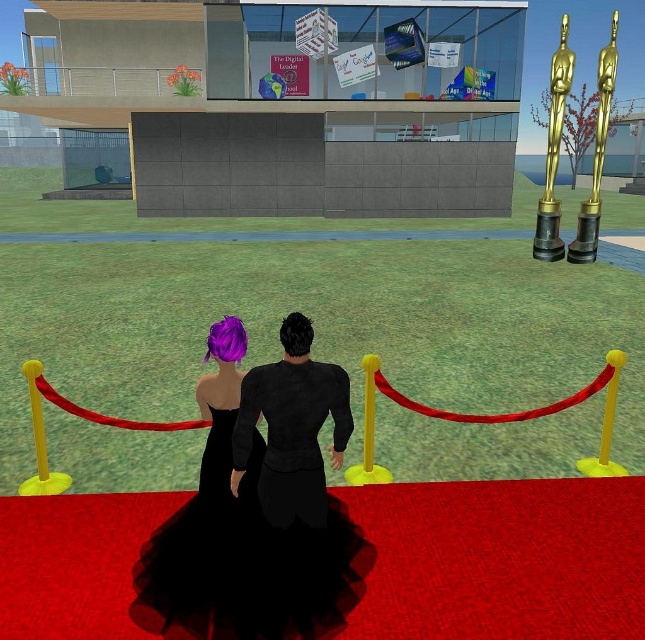
Is black velvet suit at center thinner than shiny purple hair at center?

Indeed, black velvet suit at center has a lesser width compared to shiny purple hair at center.

Can you confirm if black velvet suit at center is positioned below shiny purple hair at center?

Actually, black velvet suit at center is above shiny purple hair at center.

You are a GUI agent. You are given a task and a screenshot of the screen. Output one action in this format:
    pyautogui.click(x=<x>, y=<y>)
    Task: Click on the black velvet suit at center
    
    Given the screenshot: What is the action you would take?
    pyautogui.click(x=297, y=483)

Does black tulle dress at center have a larger size compared to shiny purple hair at center?

Indeed, black tulle dress at center has a larger size compared to shiny purple hair at center.

From the picture: Can you confirm if black tulle dress at center is thinner than shiny purple hair at center?

In fact, black tulle dress at center might be wider than shiny purple hair at center.

At what (x,y) coordinates should I click in order to perform the action: click on black tulle dress at center. Please return your answer as a coordinate pair (x, y). The height and width of the screenshot is (640, 645). Looking at the image, I should click on (244, 561).

Identify the location of black tulle dress at center. The height and width of the screenshot is (640, 645). (244, 561).

Is black tulle dress at center bigger than black velvet suit at center?

Indeed, black tulle dress at center has a larger size compared to black velvet suit at center.

Looking at this image, who is more distant from viewer, (290, 541) or (312, 516)?

The point (290, 541) is behind.

Is point (283, 572) in front of point (290, 371)?

No.

Locate an element on the screen. This screenshot has height=640, width=645. black tulle dress at center is located at coordinates (244, 561).